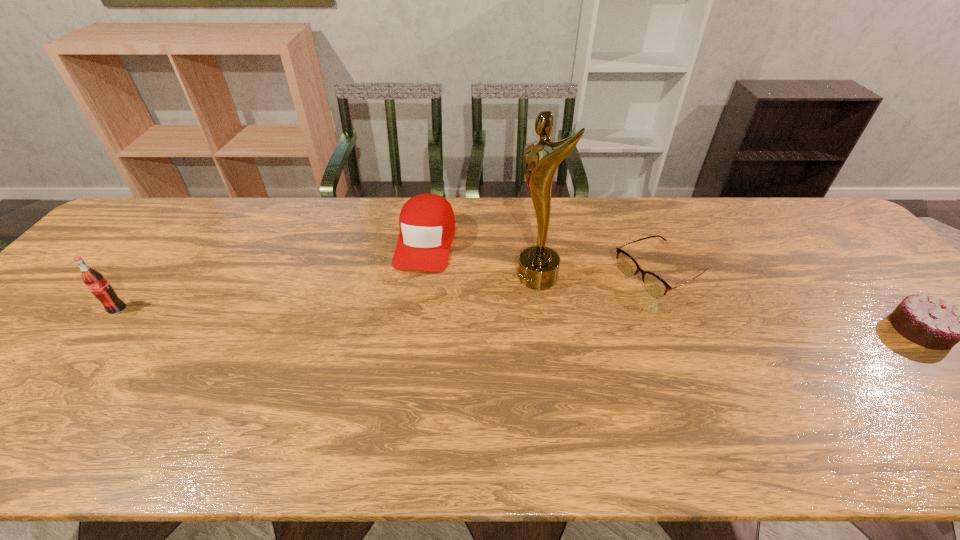
This screenshot has height=540, width=960. I want to click on the fourth shortest object, so [95, 281].

Locate an element on the screen. The image size is (960, 540). soda bottle is located at coordinates (95, 281).

Identify the location of the second object from left to right. (427, 224).

Locate an element on the screen. This screenshot has height=540, width=960. baseball cap is located at coordinates (427, 224).

Find the location of a particular element. spectacles is located at coordinates point(657,287).

What are the coordinates of `the shortest object` in the screenshot? It's located at (657, 287).

Identify the location of the tallest object. (538, 266).

At what (x,y) coordinates should I click in order to perform the action: click on award. Please return your answer as a coordinate pair (x, y). Image resolution: width=960 pixels, height=540 pixels. Looking at the image, I should click on (538, 266).

Find the location of `blank space located on the label of the soda bottle`. blank space located on the label of the soda bottle is located at coordinates (40, 403).

Identify the location of free space located on the front-facing side of the second object from left to right. (411, 300).